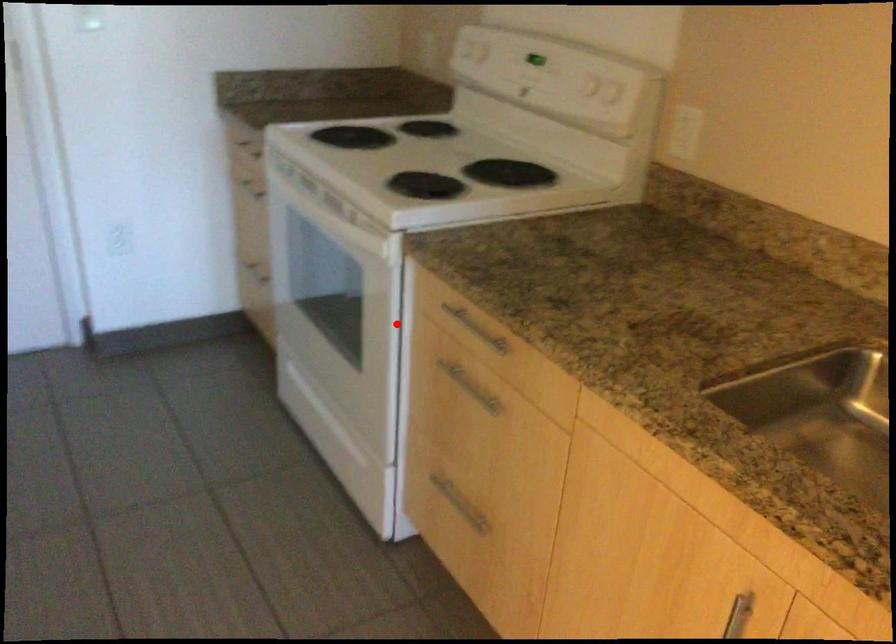
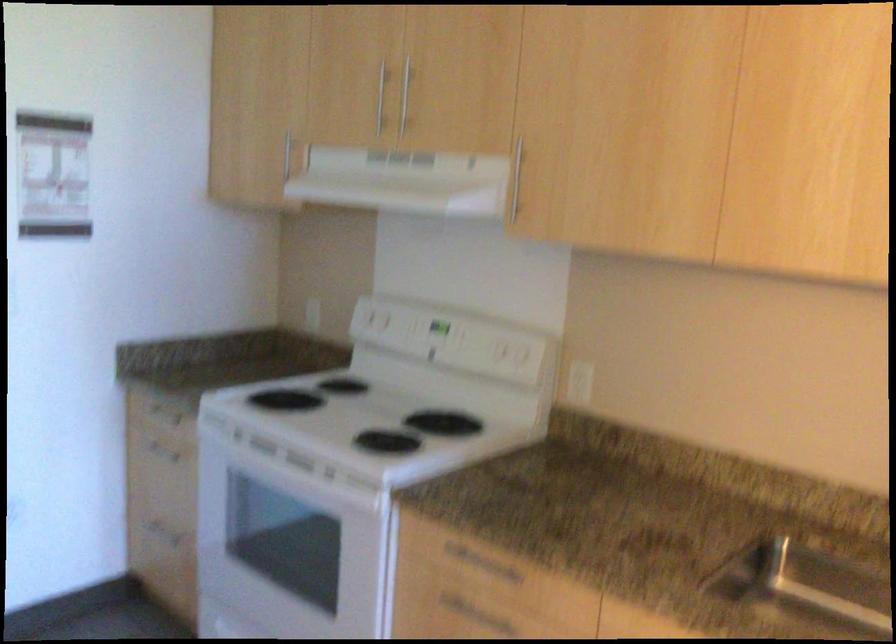
In the second image, find the point that corresponds to the highlighted location in the first image.

(385, 571)